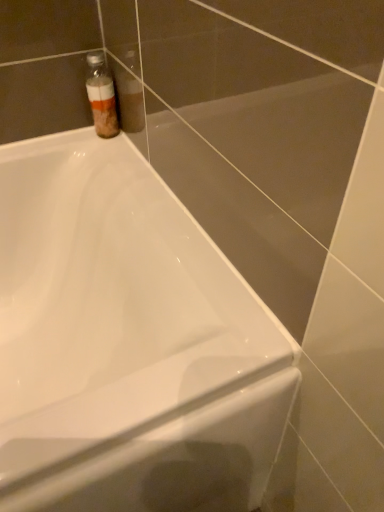
Describe the element at coordinates (101, 95) in the screenshot. I see `translucent plastic bottle at upper left` at that location.

The height and width of the screenshot is (512, 384). I want to click on translucent plastic bottle at upper left, so click(x=101, y=95).

Based on the photo, measure the distance between point (96, 116) and camera.

35.71 inches.

The width and height of the screenshot is (384, 512). Describe the element at coordinates (127, 342) in the screenshot. I see `white glossy bathtub at upper left` at that location.

I want to click on white glossy bathtub at upper left, so click(x=127, y=342).

Identify the location of translucent plastic bottle at upper left. (101, 95).

Does white glossy bathtub at upper left appear on the left side of translucent plastic bottle at upper left?

Yes, white glossy bathtub at upper left is to the left of translucent plastic bottle at upper left.

Which object is more forward, white glossy bathtub at upper left or translucent plastic bottle at upper left?

Positioned in front is white glossy bathtub at upper left.

Does point (38, 450) come farther from viewer compared to point (108, 75)?

No.

From the image's perspective, would you say white glossy bathtub at upper left is shown under translucent plastic bottle at upper left?

Correct, white glossy bathtub at upper left appears lower than translucent plastic bottle at upper left in the image.

From a real-world perspective, which is physically above, white glossy bathtub at upper left or translucent plastic bottle at upper left?

translucent plastic bottle at upper left, from a real-world perspective.

Between white glossy bathtub at upper left and translucent plastic bottle at upper left, which one has smaller width?

translucent plastic bottle at upper left is thinner.

Considering the relative sizes of white glossy bathtub at upper left and translucent plastic bottle at upper left in the image provided, is white glossy bathtub at upper left taller than translucent plastic bottle at upper left?

Correct, white glossy bathtub at upper left is much taller as translucent plastic bottle at upper left.

Consider the image. Can you confirm if white glossy bathtub at upper left is smaller than translucent plastic bottle at upper left?

No, white glossy bathtub at upper left is not smaller than translucent plastic bottle at upper left.

In the scene shown: Is white glossy bathtub at upper left outside of translucent plastic bottle at upper left?

Yes.

Is white glossy bathtub at upper left next to translucent plastic bottle at upper left and touching it?

No.

Is white glossy bathtub at upper left oriented away from translucent plastic bottle at upper left?

No, white glossy bathtub at upper left is not facing the opposite direction of translucent plastic bottle at upper left.

What's the angular difference between white glossy bathtub at upper left and translucent plastic bottle at upper left's facing directions?

0.00166 degrees.

Find the location of `bottle above the white glossy bathtub at upper left (from a real-world perspective)`. bottle above the white glossy bathtub at upper left (from a real-world perspective) is located at coordinates (101, 95).

Does translucent plastic bottle at upper left appear on the left side of white glossy bathtub at upper left?

In fact, translucent plastic bottle at upper left is to the right of white glossy bathtub at upper left.

Which object is closer to the camera taking this photo, translucent plastic bottle at upper left or white glossy bathtub at upper left?

white glossy bathtub at upper left is more forward.

Which is further, (104, 91) or (46, 161)?

The point (46, 161) is farther.

From the image's perspective, which is above, translucent plastic bottle at upper left or white glossy bathtub at upper left?

translucent plastic bottle at upper left.

From a real-world perspective, is translucent plastic bottle at upper left on top of white glossy bathtub at upper left?

Yes, from a real-world perspective, translucent plastic bottle at upper left is over white glossy bathtub at upper left

Considering the sizes of objects translucent plastic bottle at upper left and white glossy bathtub at upper left in the image provided, who is thinner, translucent plastic bottle at upper left or white glossy bathtub at upper left?

Thinner between the two is translucent plastic bottle at upper left.

Considering the sizes of translucent plastic bottle at upper left and white glossy bathtub at upper left in the image, is translucent plastic bottle at upper left taller or shorter than white glossy bathtub at upper left?

translucent plastic bottle at upper left is shorter than white glossy bathtub at upper left.

Considering the relative sizes of translucent plastic bottle at upper left and white glossy bathtub at upper left in the image provided, is translucent plastic bottle at upper left bigger than white glossy bathtub at upper left?

Incorrect, translucent plastic bottle at upper left is not larger than white glossy bathtub at upper left.

Consider the image. Is translucent plastic bottle at upper left situated inside white glossy bathtub at upper left or outside?

translucent plastic bottle at upper left lies outside white glossy bathtub at upper left.

Are translucent plastic bottle at upper left and white glossy bathtub at upper left beside each other?

No, translucent plastic bottle at upper left is not with white glossy bathtub at upper left.

Is translucent plastic bottle at upper left oriented towards white glossy bathtub at upper left?

No, translucent plastic bottle at upper left does not turn towards white glossy bathtub at upper left.

How far apart are translucent plastic bottle at upper left and white glossy bathtub at upper left?

translucent plastic bottle at upper left is 16.13 inches away from white glossy bathtub at upper left.

You are a GUI agent. You are given a task and a screenshot of the screen. Output one action in this format:
    pyautogui.click(x=<x>, y=<y>)
    Task: Click on the bathtub to the left of translucent plastic bottle at upper left
    The height and width of the screenshot is (512, 384).
    Given the screenshot: What is the action you would take?
    pyautogui.click(x=127, y=342)

Image resolution: width=384 pixels, height=512 pixels. What are the coordinates of `bathtub located on the left of translucent plastic bottle at upper left` in the screenshot? It's located at (127, 342).

Find the location of `bottle on the right of white glossy bathtub at upper left`. bottle on the right of white glossy bathtub at upper left is located at coordinates (101, 95).